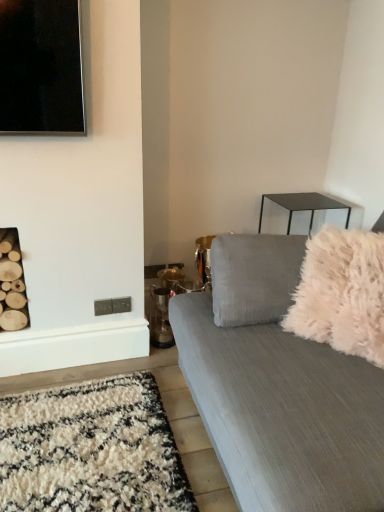
Question: Considering the relative sizes of textured gray couch at right and white fluffy throw pillow at right in the image provided, is textured gray couch at right thinner than white fluffy throw pillow at right?

Choices:
 (A) no
 (B) yes

Answer: (A)

Question: Is white fluffy throw pillow at right inside textured gray couch at right?

Choices:
 (A) no
 (B) yes

Answer: (B)

Question: Is textured gray couch at right oriented away from white fluffy throw pillow at right?

Choices:
 (A) no
 (B) yes

Answer: (B)

Question: Considering the relative sizes of textured gray couch at right and white fluffy throw pillow at right in the image provided, is textured gray couch at right taller than white fluffy throw pillow at right?

Choices:
 (A) yes
 (B) no

Answer: (A)

Question: Considering the relative sizes of textured gray couch at right and white fluffy throw pillow at right in the image provided, is textured gray couch at right wider than white fluffy throw pillow at right?

Choices:
 (A) yes
 (B) no

Answer: (A)

Question: From a real-world perspective, is textured gray couch at right physically below white fluffy throw pillow at right?

Choices:
 (A) yes
 (B) no

Answer: (A)

Question: Considering the relative sizes of white fluffy throw pillow at right and textured gray couch at right in the image provided, is white fluffy throw pillow at right shorter than textured gray couch at right?

Choices:
 (A) yes
 (B) no

Answer: (A)

Question: Is white fluffy throw pillow at right positioned before textured gray couch at right?

Choices:
 (A) yes
 (B) no

Answer: (B)

Question: Is white fluffy throw pillow at right looking in the opposite direction of textured gray couch at right?

Choices:
 (A) yes
 (B) no

Answer: (A)

Question: Does white fluffy throw pillow at right turn towards textured gray couch at right?

Choices:
 (A) no
 (B) yes

Answer: (B)

Question: Is white fluffy throw pillow at right to the left of textured gray couch at right from the viewer's perspective?

Choices:
 (A) no
 (B) yes

Answer: (B)

Question: Can you confirm if white fluffy throw pillow at right is taller than textured gray couch at right?

Choices:
 (A) yes
 (B) no

Answer: (B)

Question: From a real-world perspective, relative to white fluffy throw pillow at right, is textured gray couch at right vertically above or below?

Choices:
 (A) below
 (B) above

Answer: (A)